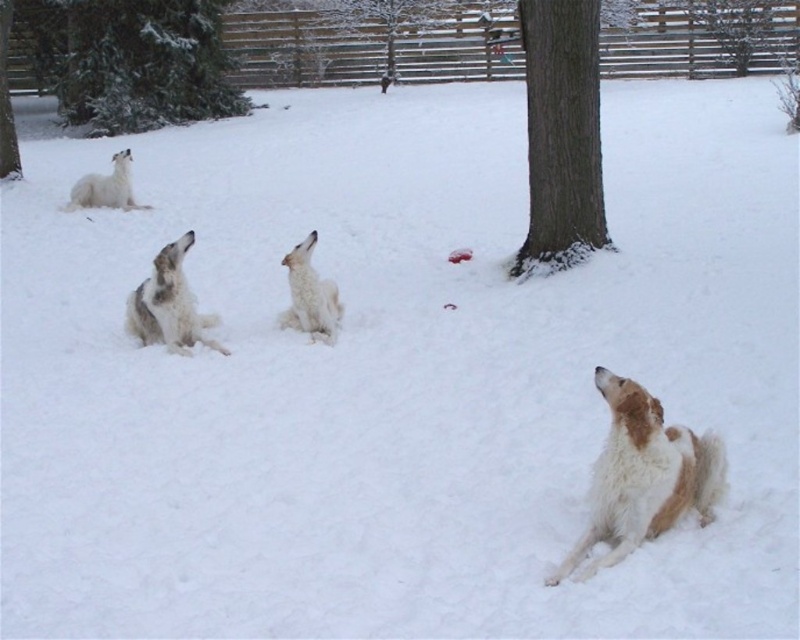
Question: Which object appears closest to the camera in this image?

Choices:
 (A) brown rough bark tree at center
 (B) white fur dog at center
 (C) green textured tree at upper left
 (D) brown textured tree at center

Answer: (B)

Question: Which object appears closest to the camera in this image?

Choices:
 (A) white fur dog at center
 (B) brown wood tree at upper center

Answer: (A)

Question: Can you confirm if brown wood tree at upper center is positioned to the right of white fluffy dog at upper left?

Choices:
 (A) no
 (B) yes

Answer: (B)

Question: Can you confirm if brown and white fur dog at lower right is thinner than brown textured tree at center?

Choices:
 (A) yes
 (B) no

Answer: (A)

Question: Is green textured evergreen tree at upper left positioned before white fluffy dog at upper left?

Choices:
 (A) yes
 (B) no

Answer: (B)

Question: Which object is the closest to the white fluffy dog at center?

Choices:
 (A) green textured tree at upper left
 (B) white fluffy dog at upper left
 (C) brown wood tree at upper center

Answer: (B)